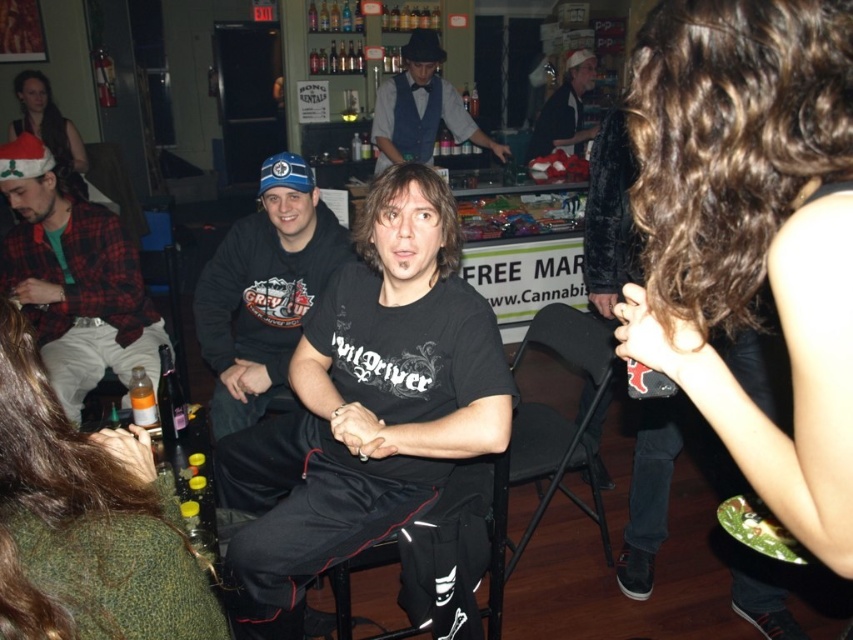
You are a person who is 1.8 meters tall and want to reach a shelf that is 2.5 meters high. You have a green woolen sweater at lower left and a flannel shirt at left. Can you use these items to reach the shelf?

The green woolen sweater at lower left is 1.79 meters from flannel shirt at left. Since the distance between them is less than your height, you can stack them to reach the shelf which is 2.5 meters high.

You are standing in the bar and want to place a gift box on the table where the santa hat at upper left is located. The gift box requires 12 feet of space to be placed safely. Can you fit the gift box there?

The distance between the santa hat at upper left and the viewer is 13.37 feet. Since the required space is 12 feet, the gift box can be placed safely there as there is enough space.